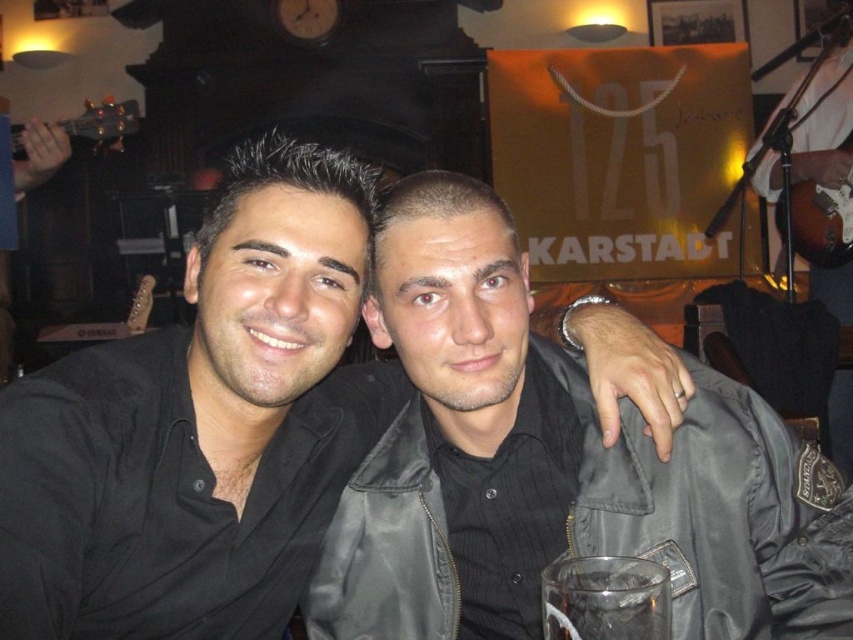
Is black matte shirt at center to the right of clear glass at lower center from the viewer's perspective?

No, black matte shirt at center is not to the right of clear glass at lower center.

Is black matte shirt at center above clear glass at lower center?

Yes, black matte shirt at center is above clear glass at lower center.

Is point (56, 632) more distant than point (625, 634)?

Yes.

I want to click on black matte shirt at center, so click(x=202, y=426).

Who is taller, black leather jacket at center or clear glass at lower center?

black leather jacket at center is taller.

Who is higher up, black leather jacket at center or clear glass at lower center?

black leather jacket at center is higher up.

Is point (732, 580) positioned after point (581, 576)?

Yes, point (732, 580) is farther from viewer.

The height and width of the screenshot is (640, 853). Find the location of `black leather jacket at center`. black leather jacket at center is located at coordinates (717, 509).

Who is taller, black matte shirt at center or black leather jacket at center?

black matte shirt at center is taller.

In the scene shown: Is black matte shirt at center above black leather jacket at center?

Yes, black matte shirt at center is above black leather jacket at center.

The image size is (853, 640). What are the coordinates of `black matte shirt at center` in the screenshot? It's located at (202, 426).